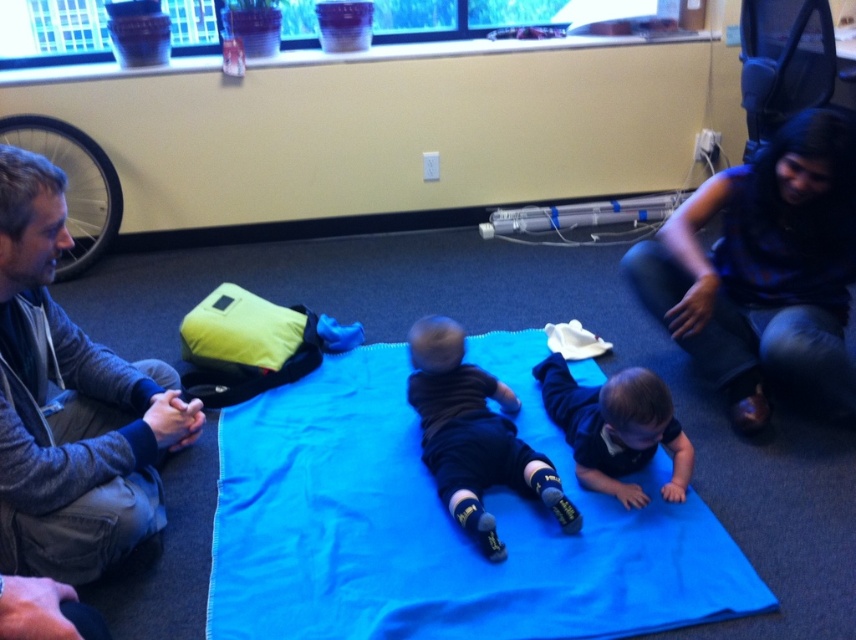
You are a photographer setting up for a photo shoot in this room. You need to place a large equipment bag that requires a space larger than the gray fleece jacket at left. Can the blue fabric at center provide enough space for it?

The blue fabric at center is bigger than the gray fleece jacket at left, so yes, the blue fabric at center can provide enough space for the large equipment bag since it is larger than the gray fleece jacket at left.